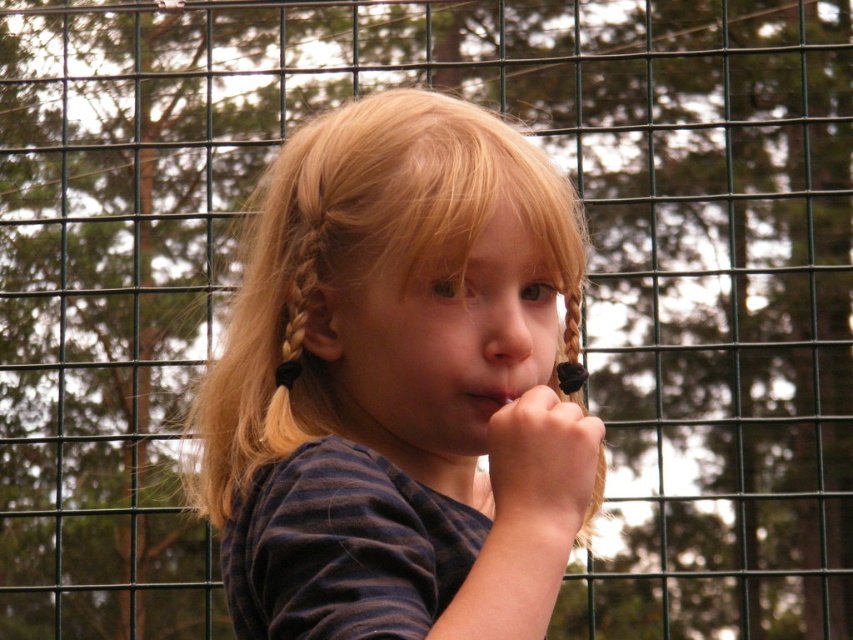
Which is above, smooth skin hand at center or blonde braided hair at center?

smooth skin hand at center

Which is in front, point (532, 433) or point (582, 529)?

Point (532, 433) is more forward.

Locate an element on the screen. smooth skin hand at center is located at coordinates (543, 465).

In the scene shown: Which is above, smooth skin hand at center or matte pink lips at center?

matte pink lips at center

Describe the element at coordinates (543, 465) in the screenshot. I see `smooth skin hand at center` at that location.

The image size is (853, 640). What do you see at coordinates (543, 465) in the screenshot? I see `smooth skin hand at center` at bounding box center [543, 465].

You are a GUI agent. You are given a task and a screenshot of the screen. Output one action in this format:
    pyautogui.click(x=<x>, y=<y>)
    Task: Click on the smooth skin hand at center
    Image resolution: width=853 pixels, height=640 pixels.
    Given the screenshot: What is the action you would take?
    pyautogui.click(x=543, y=465)

How much distance is there between blonde hair at center and blonde braided hair at center?

blonde hair at center and blonde braided hair at center are 3.20 inches apart.

Who is taller, blonde hair at center or blonde braided hair at center?

blonde hair at center is taller.

Is point (306, 246) in front of point (596, 504)?

That is True.

Find the location of `blonde hair at center`. blonde hair at center is located at coordinates point(399,381).